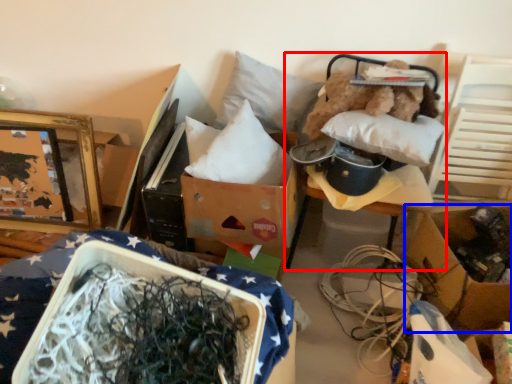
Question: Among these objects, which one is farthest to the camera, furniture (highlighted by a red box) or cardboard box (highlighted by a blue box)?

Choices:
 (A) furniture
 (B) cardboard box

Answer: (B)